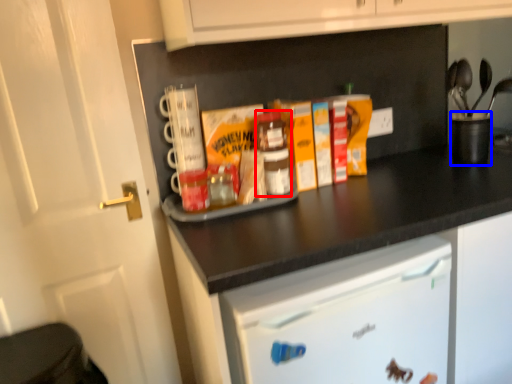
Question: Which point is closer to the camera, bottle (highlighted by a red box) or appliance (highlighted by a blue box)?

Choices:
 (A) bottle
 (B) appliance

Answer: (A)